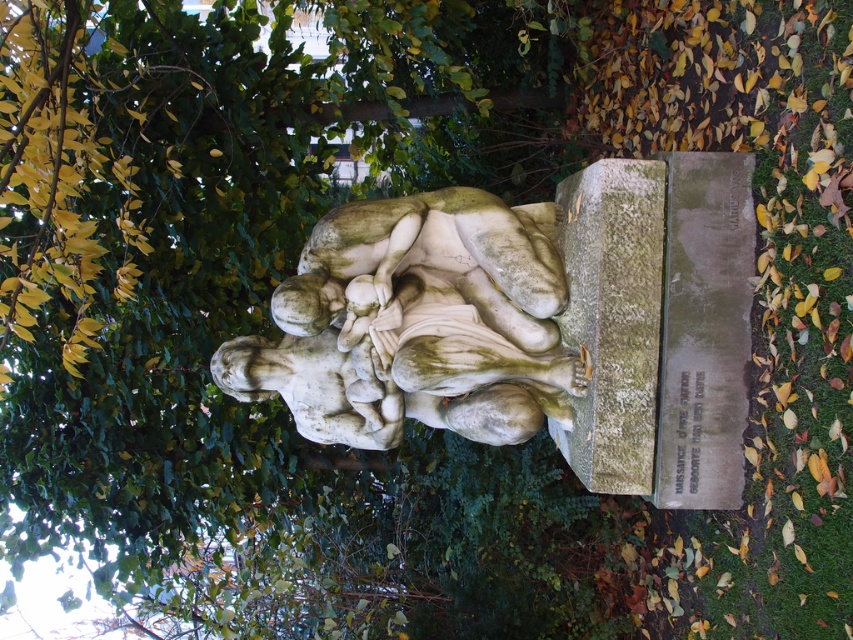
You are a park visitor who wants to take a photo of the white marble statue at center and the green mossy stone at center. Since you want both in the frame, which one should you position closer to the camera to ensure both are fully visible?

The white marble statue at center is positioned on the left side of green mossy stone at center. To include both in the photo, position the camera closer to the white marble statue at center so that the green mossy stone at center is also within the frame.